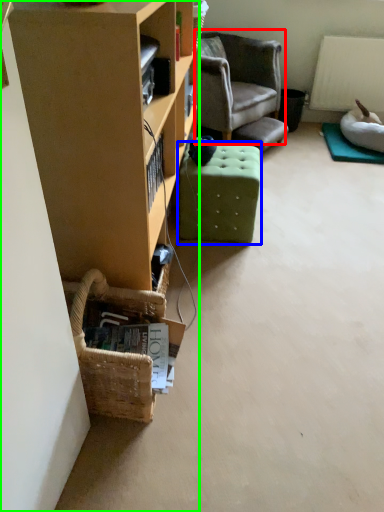
Question: Considering the real-world distances, which object is closest to chair (highlighted by a red box)? stool (highlighted by a blue box) or cabinetry (highlighted by a green box).

Choices:
 (A) stool
 (B) cabinetry

Answer: (A)